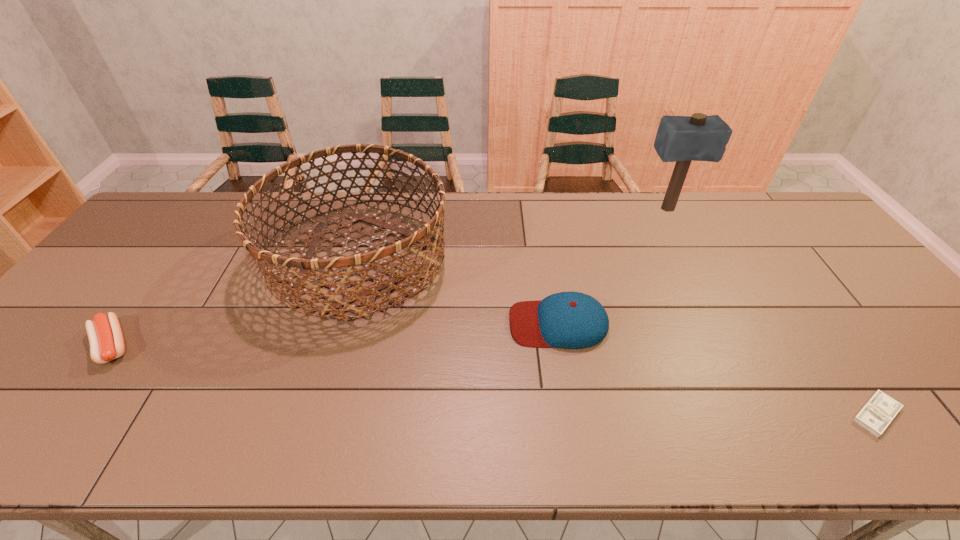
Identify the location of vacant space located on the left of the mallet. (531, 209).

The width and height of the screenshot is (960, 540). In order to click on vacant space located on the right of the second tallest object in this screenshot , I will do `click(571, 259)`.

The height and width of the screenshot is (540, 960). What are the coordinates of `vacant space situated 0.360m with the bill of the baseball cap facing forward` in the screenshot? It's located at (369, 323).

The image size is (960, 540). I want to click on free region located 0.050m with the bill of the baseball cap facing forward, so click(490, 323).

The width and height of the screenshot is (960, 540). What are the coordinates of `vacant position located 0.260m with the bill of the baseball cap facing forward` in the screenshot? It's located at (408, 323).

Find the location of a particular element. This screenshot has height=540, width=960. free spot located 0.220m on the back of the fourth tallest object is located at coordinates [172, 264].

The image size is (960, 540). In order to click on free spot located on the back of the nearest object in this screenshot , I will do `click(828, 346)`.

Find the location of `mallet present at the far edge`. mallet present at the far edge is located at coordinates (681, 139).

What are the coordinates of `basket that is at the far edge` in the screenshot? It's located at (311, 262).

The image size is (960, 540). I want to click on object at the near edge, so click(x=875, y=416).